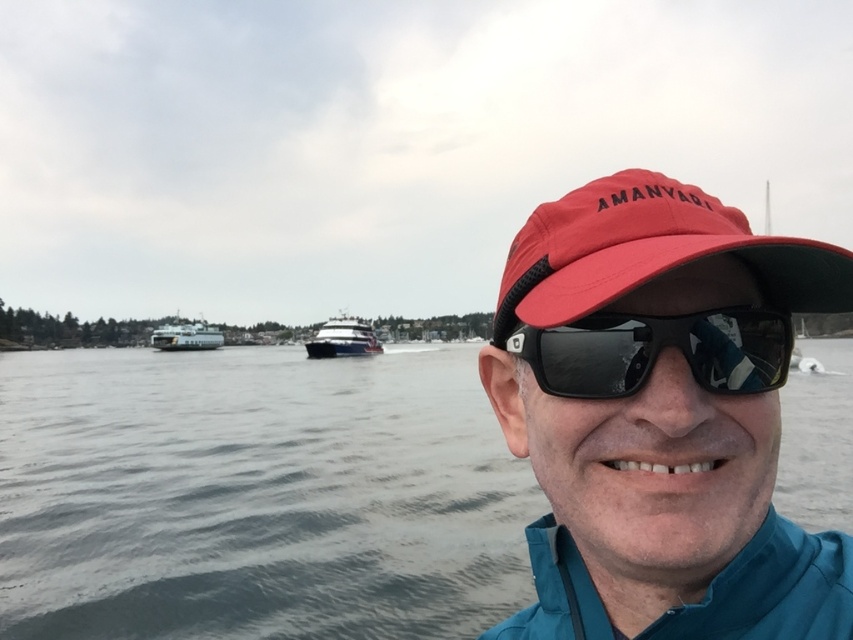
Question: Considering the real-world distances, which object is closest to the red fabric cap at center?

Choices:
 (A) silver metallic ferry at center
 (B) black reflective sunglasses at center

Answer: (B)

Question: Is black reflective sunglasses at center positioned behind silver metallic ferry at center?

Choices:
 (A) no
 (B) yes

Answer: (A)

Question: Does red fabric cap at center lie behind shiny blue yacht at center?

Choices:
 (A) yes
 (B) no

Answer: (B)

Question: Which is nearer to the gray water at center?

Choices:
 (A) black reflective sunglasses at center
 (B) shiny blue yacht at center

Answer: (B)

Question: Is matte red cap at center above shiny blue yacht at center?

Choices:
 (A) no
 (B) yes

Answer: (B)

Question: Which point is farther from the camera taking this photo?

Choices:
 (A) (757, 328)
 (B) (193, 348)
 (C) (705, 380)
 (D) (363, 353)

Answer: (B)